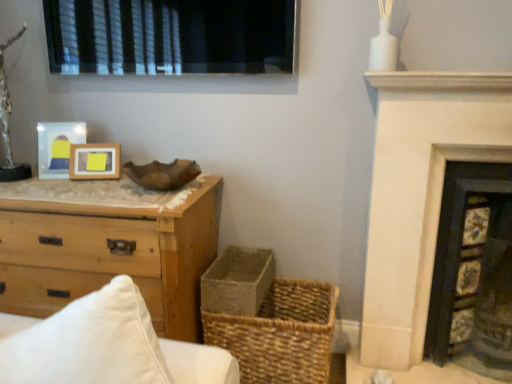
This screenshot has height=384, width=512. Find the location of `rustic woven basket at lower center`. rustic woven basket at lower center is located at coordinates (238, 281).

What is the approximate height of woven straw basket at lower center?

44.50 centimeters.

I want to click on matte wood picture frame at upper left, the second picture frame from the right, so click(57, 147).

Does wooden frame at center, the second picture frame viewed from the left, contain matte wood picture frame at upper left, which appears as the 1th picture frame when viewed from the left?

No, wooden frame at center, the second picture frame viewed from the left, does not contain matte wood picture frame at upper left, which appears as the 1th picture frame when viewed from the left.

Between wooden frame at center, the second picture frame viewed from the left, and matte wood picture frame at upper left, which appears as the 1th picture frame when viewed from the left, which one has less height?

wooden frame at center, the second picture frame viewed from the left, is shorter.

Is point (91, 158) positioned behind point (38, 141)?

No.

Considering the relative positions of wooden frame at center, the second picture frame viewed from the left, and matte wood picture frame at upper left, which appears as the 1th picture frame when viewed from the left, in the image provided, is wooden frame at center, the second picture frame viewed from the left, behind matte wood picture frame at upper left, which appears as the 1th picture frame when viewed from the left,?

No.

Considering the sizes of black matte window at upper center and matte wood picture frame at upper left, which appears as the 1th picture frame when viewed from the left, in the image, is black matte window at upper center bigger or smaller than matte wood picture frame at upper left, which appears as the 1th picture frame when viewed from the left,?

black matte window at upper center is bigger than matte wood picture frame at upper left, which appears as the 1th picture frame when viewed from the left.

Is black matte window at upper center completely or partially outside of matte wood picture frame at upper left, the second picture frame from the right?

Yes.

From a real-world perspective, which object stands above the other?

black matte window at upper center.

Which is in front, black matte window at upper center or matte wood picture frame at upper left, which appears as the 1th picture frame when viewed from the left?

black matte window at upper center.

Does point (81, 130) come in front of point (115, 161)?

That is False.

From the image's perspective, between matte wood picture frame at upper left, the second picture frame from the right, and wooden frame at center, which appears as the first picture frame when viewed from the right, which one is located above?

matte wood picture frame at upper left, the second picture frame from the right, is shown above in the image.

Can wooden frame at center, which appears as the first picture frame when viewed from the right, be found inside matte wood picture frame at upper left, which appears as the 1th picture frame when viewed from the left?

No, wooden frame at center, which appears as the first picture frame when viewed from the right, is not a part of matte wood picture frame at upper left, which appears as the 1th picture frame when viewed from the left.

Could you measure the distance between white stone fireplace at upper right, the second fireplace viewed from the right, and natural wood chest of drawers at left?

white stone fireplace at upper right, the second fireplace viewed from the right, and natural wood chest of drawers at left are 37.30 inches apart from each other.

Considering the relative positions of white stone fireplace at upper right, which is counted as the first fireplace, starting from the left, and natural wood chest of drawers at left in the image provided, is white stone fireplace at upper right, which is counted as the first fireplace, starting from the left, to the left of natural wood chest of drawers at left from the viewer's perspective?

In fact, white stone fireplace at upper right, which is counted as the first fireplace, starting from the left, is to the right of natural wood chest of drawers at left.

Is white stone fireplace at upper right, the second fireplace viewed from the right, surrounding natural wood chest of drawers at left?

That's incorrect, natural wood chest of drawers at left is not inside white stone fireplace at upper right, the second fireplace viewed from the right.

From the image's perspective, does white stone fireplace at upper right, which is counted as the first fireplace, starting from the left, appear higher than natural wood chest of drawers at left?

Yes, from the image's perspective, white stone fireplace at upper right, which is counted as the first fireplace, starting from the left, is above natural wood chest of drawers at left.

From a real-world perspective, starting from the natural wood chest of drawers at left, which picture frame is the 1st one vertically above it? Please provide its 2D coordinates.

[(95, 161)]

Considering the relative positions of wooden frame at center, the second picture frame viewed from the left, and natural wood chest of drawers at left in the image provided, is wooden frame at center, the second picture frame viewed from the left, to the left of natural wood chest of drawers at left from the viewer's perspective?

No.

Is wooden frame at center, which appears as the first picture frame when viewed from the right, located outside natural wood chest of drawers at left?

Yes, wooden frame at center, which appears as the first picture frame when viewed from the right, is outside of natural wood chest of drawers at left.

In the scene shown: From the image's perspective, is wooden frame at center, the second picture frame viewed from the left, located above natural wood chest of drawers at left?

Yes, from the image's perspective, wooden frame at center, the second picture frame viewed from the left, is on top of natural wood chest of drawers at left.

Considering the sizes of woven straw basket at lower center and rustic woven basket at lower center in the image, is woven straw basket at lower center bigger or smaller than rustic woven basket at lower center?

Clearly, woven straw basket at lower center is larger in size than rustic woven basket at lower center.

Measure the distance between woven straw basket at lower center and rustic woven basket at lower center.

6.31 inches.

Is point (325, 332) farther from viewer compared to point (260, 281)?

That is False.

Considering the positions of objects woven straw basket at lower center and rustic woven basket at lower center in the image provided, who is more to the left, woven straw basket at lower center or rustic woven basket at lower center?

From the viewer's perspective, rustic woven basket at lower center appears more on the left side.

What's the angular difference between rustic woven basket at lower center and white stone fireplace at upper right, the second fireplace viewed from the right,'s facing directions?

The angle between the facing direction of rustic woven basket at lower center and the facing direction of white stone fireplace at upper right, the second fireplace viewed from the right, is 0.000498 degrees.

Is rustic woven basket at lower center facing towards white stone fireplace at upper right, the second fireplace viewed from the right?

No, rustic woven basket at lower center does not turn towards white stone fireplace at upper right, the second fireplace viewed from the right.

Considering the sizes of objects rustic woven basket at lower center and white stone fireplace at upper right, which is counted as the first fireplace, starting from the left, in the image provided, who is smaller, rustic woven basket at lower center or white stone fireplace at upper right, which is counted as the first fireplace, starting from the left,?

rustic woven basket at lower center is smaller.

Locate an element on the screen. picture frame that is under the matte wood picture frame at upper left, which appears as the 1th picture frame when viewed from the left (from a real-world perspective) is located at coordinates (95, 161).

At what (x,y) coordinates should I click in order to perform the action: click on the 1st picture frame below the black matte window at upper center (from the image's perspective). Please return your answer as a coordinate pair (x, y). The height and width of the screenshot is (384, 512). Looking at the image, I should click on [x=57, y=147].

From the image, which object appears to be nearer to black matte window at upper center, rustic woven basket at lower center or woven straw basket at lower center?

rustic woven basket at lower center lies closer to black matte window at upper center than the other object.

Estimate the real-world distances between objects in this image. Which object is closer to wooden frame at center, which appears as the first picture frame when viewed from the right, dark gray stone fireplace at right, positioned as the first fireplace in right-to-left order, or matte wood picture frame at upper left, the second picture frame from the right?

matte wood picture frame at upper left, the second picture frame from the right, is closer to wooden frame at center, which appears as the first picture frame when viewed from the right.

Based on their spatial positions, is natural wood chest of drawers at left or black matte window at upper center closer to rustic woven basket at lower center?

Based on the image, natural wood chest of drawers at left appears to be nearer to rustic woven basket at lower center.

From the image, which object appears to be nearer to matte wood picture frame at upper left, the second picture frame from the right, white stone fireplace at upper right, the second fireplace viewed from the right, or woven straw basket at lower center?

woven straw basket at lower center is closer to matte wood picture frame at upper left, the second picture frame from the right.

Estimate the real-world distances between objects in this image. Which object is closer to natural wood chest of drawers at left, white stone fireplace at upper right, the second fireplace viewed from the right, or dark gray stone fireplace at right, positioned as the first fireplace in right-to-left order?

white stone fireplace at upper right, the second fireplace viewed from the right.

Considering their positions, is natural wood chest of drawers at left positioned further to dark gray stone fireplace at right, positioned as the first fireplace in right-to-left order, than rustic woven basket at lower center?

Based on the image, natural wood chest of drawers at left appears to be further to dark gray stone fireplace at right, positioned as the first fireplace in right-to-left order.

Looking at the image, which one is located further to woven straw basket at lower center, dark gray stone fireplace at right, positioned as the first fireplace in right-to-left order, or wooden frame at center, which appears as the first picture frame when viewed from the right?

wooden frame at center, which appears as the first picture frame when viewed from the right, is further to woven straw basket at lower center.

When comparing their distances from woven straw basket at lower center, does rustic woven basket at lower center or white stone fireplace at upper right, the second fireplace viewed from the right, seem further?

white stone fireplace at upper right, the second fireplace viewed from the right, is positioned further to the anchor woven straw basket at lower center.

I want to click on fireplace between matte wood picture frame at upper left, the second picture frame from the right, and dark gray stone fireplace at right, marked as the 2th fireplace in a left-to-right arrangement, in the horizontal direction, so (x=420, y=194).

Locate an element on the screen. The width and height of the screenshot is (512, 384). chest of drawers between matte wood picture frame at upper left, the second picture frame from the right, and dark gray stone fireplace at right, marked as the 2th fireplace in a left-to-right arrangement, from left to right is located at coordinates [x=110, y=255].

Find the location of `fireplace between rustic woven basket at lower center and dark gray stone fireplace at right, marked as the 2th fireplace in a left-to-right arrangement, from left to right`. fireplace between rustic woven basket at lower center and dark gray stone fireplace at right, marked as the 2th fireplace in a left-to-right arrangement, from left to right is located at coordinates (420, 194).

Image resolution: width=512 pixels, height=384 pixels. I want to click on window situated between wooden frame at center, which appears as the first picture frame when viewed from the right, and dark gray stone fireplace at right, marked as the 2th fireplace in a left-to-right arrangement, from left to right, so click(x=170, y=36).